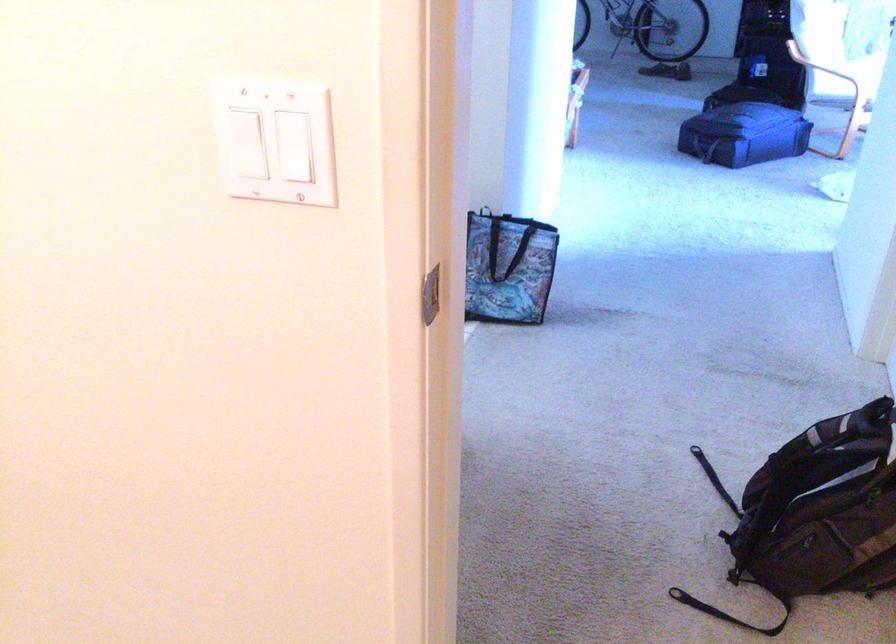
What do you see at coordinates (713, 478) in the screenshot? The width and height of the screenshot is (896, 644). I see `a black backpack strap` at bounding box center [713, 478].